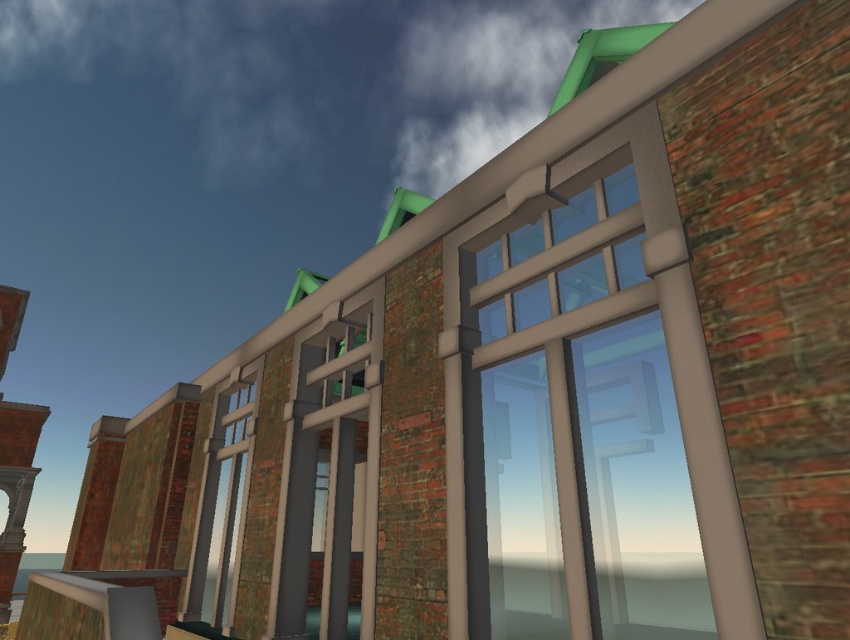
You are an architect reviewing the building design. You notice the clear glass window at upper center and the brick tower at left. Which object is closer to the observer standing in front of the building?

The clear glass window at upper center is closer to the observer because it is in front of the brick tower at left.

You are standing in front of the building and want to locate the clear glass window at center. Which direction should you look relative to the brick tower at left?

The clear glass window at center is to the right of the brick tower at left, so you should look to the right of the brick tower at left to find it.

You are an architect analyzing the building facade. You notice the clear glass window at upper center and the brick tower at left. Which of these two elements takes up more visual space on the facade?

The brick tower at left occupies more visual space than the clear glass window at upper center because the description states that the clear glass window at upper center occupies less space than the brick tower at left.